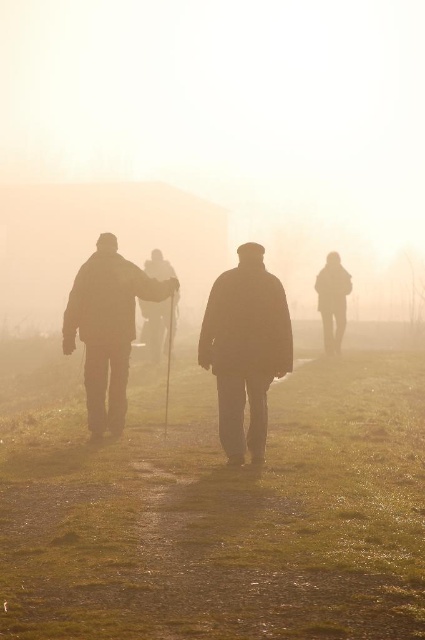
You are a hiker planning to place a small bench between the green grassy at center and the silhouette wooden cane at center. Given that the bench requires 6 feet of space, will there be enough room?

The distance between the green grassy at center and the silhouette wooden cane at center is 5.61 feet, which is less than the required 6 feet. Therefore, there is insufficient space to place the bench between them.

You are a photographer standing at the camera position. You want to capture a closeup of the silhouette coat at center. Given that your camera can focus on objects within 5 meters, will you be able to take the photo without moving closer?

The silhouette coat at center is 7.31 meters from the camera, which is beyond the 5 meter focus range. Therefore, you cannot take a closeup without moving closer.